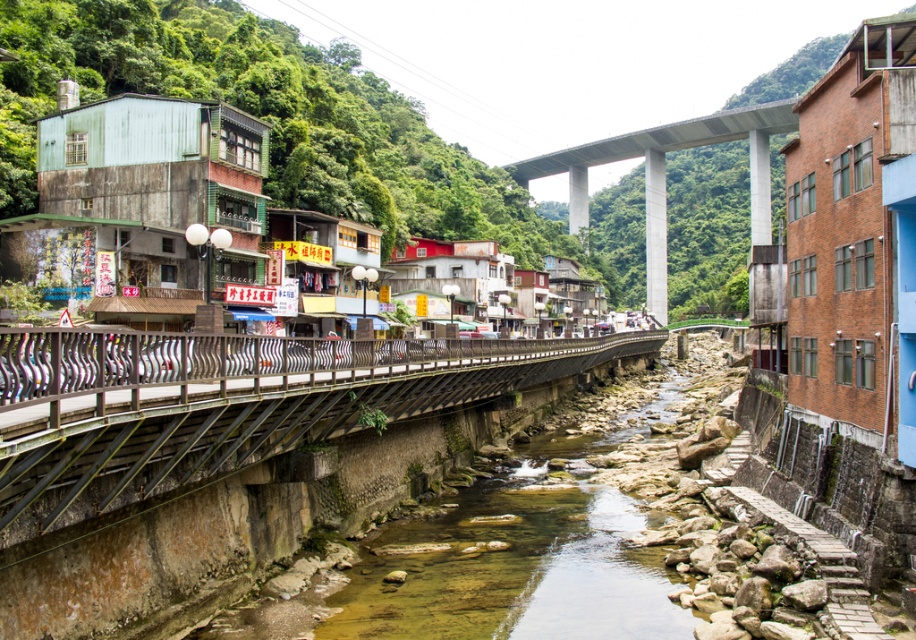
You are a drone operator tasked with capturing aerial footage of the town. Your drone has a maximum flight range of 1000 feet. If you are currently positioned at the metallic gray rail at center, can you safely fly your drone to the concrete bridge at upper center without exceeding its range?

The metallic gray rail at center and concrete bridge at upper center are 975.10 feet apart. Since the drone has a maximum range of 1000 feet, it can safely fly from the metallic gray rail at center to the concrete bridge at upper center as the distance is within the limit.

You are standing at the point marked as point (227, 404) in the image. Looking towards the river, what object is directly in front of you?

The metallic gray rail at center is directly in front of you at point (227, 404).